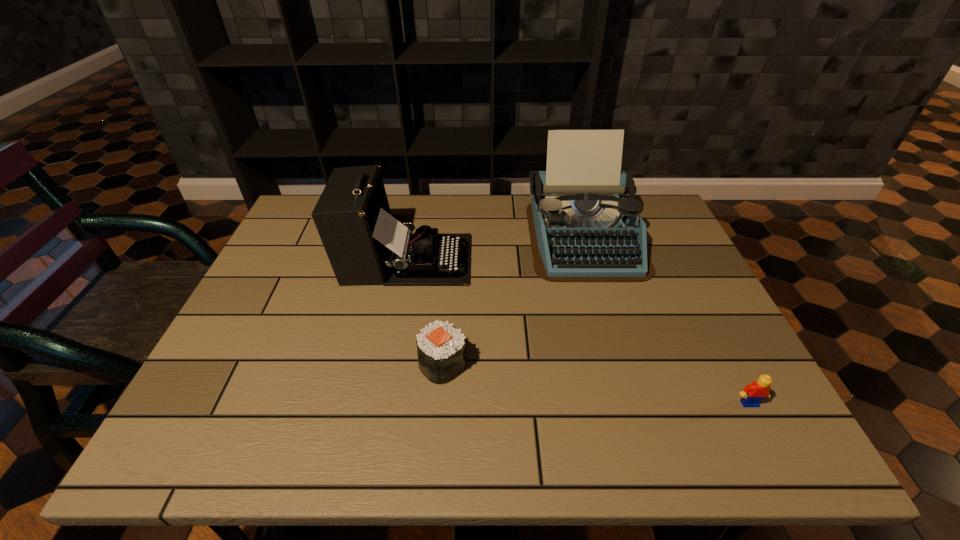
At what (x,y) coordinates should I click in order to perform the action: click on free space that satisfies the following two spatial constraints: 1. on the back side of the sushi; 2. inside the open case of the left typewriter. Please return your answer as a coordinate pair (x, y). This screenshot has width=960, height=540. Looking at the image, I should click on (451, 259).

Identify the location of vacant area in the image that satisfies the following two spatial constraints: 1. inside the open case of the left typewriter; 2. on the left side of the sushi. Image resolution: width=960 pixels, height=540 pixels. (387, 364).